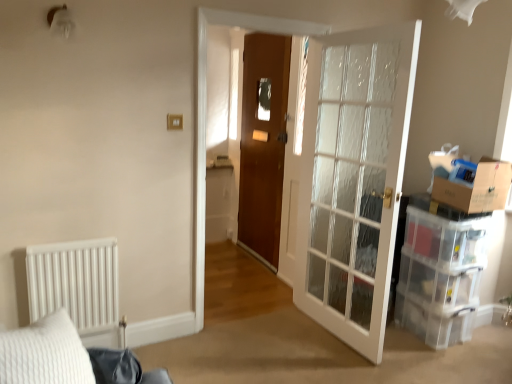
Image resolution: width=512 pixels, height=384 pixels. In order to click on wooden door at center in this screenshot , I will do `click(263, 143)`.

What do you see at coordinates (263, 143) in the screenshot? I see `wooden door at center` at bounding box center [263, 143].

Measure the distance between clear glass door at right and camera.

2.25 meters.

Locate an element on the screen. Image resolution: width=512 pixels, height=384 pixels. wooden door at center is located at coordinates (263, 143).

How much distance is there between clear plastic drawer at right and clear plastic storage box at right?

A distance of 5.93 inches exists between clear plastic drawer at right and clear plastic storage box at right.

Which of these two, clear plastic drawer at right or clear plastic storage box at right, is smaller?

clear plastic drawer at right.

Can you see clear plastic drawer at right touching clear plastic storage box at right?

No, clear plastic drawer at right is not in contact with clear plastic storage box at right.

Which is in front, point (421, 282) or point (448, 255)?

The point (448, 255) is closer.

Visually, is wooden door at center positioned to the left or to the right of clear glass door at right?

In the image, wooden door at center appears on the left side of clear glass door at right.

Is wooden door at center bigger than clear glass door at right?

Incorrect, wooden door at center is not larger than clear glass door at right.

Considering the relative sizes of wooden door at center and clear glass door at right in the image provided, is wooden door at center shorter than clear glass door at right?

No, wooden door at center is not shorter than clear glass door at right.

From the image's perspective, which one is positioned higher, wooden door at center or clear glass door at right?

wooden door at center, from the image's perspective.

From a real-world perspective, between clear glass door at right and brown cardboard box at right, who is vertically lower?

In real-world perspective, clear glass door at right is lower.

Considering the relative sizes of clear glass door at right and brown cardboard box at right in the image provided, is clear glass door at right wider than brown cardboard box at right?

No.

Based on the photo, can you confirm if clear glass door at right is positioned to the left of brown cardboard box at right?

Correct, you'll find clear glass door at right to the left of brown cardboard box at right.

Is brown cardboard box at right completely or partially inside clear glass door at right?

No.

Is clear glass door at right a part of clear plastic drawer at right?

No, clear plastic drawer at right does not contain clear glass door at right.

Is clear plastic drawer at right facing away from clear glass door at right?

That's not correct — clear plastic drawer at right is not looking away from clear glass door at right.

Consider the image. How different are the orientations of clear plastic drawer at right and clear glass door at right in degrees?

99 degrees separate the facing orientations of clear plastic drawer at right and clear glass door at right.

Are clear glass door at right and clear plastic drawer at right making contact?

clear glass door at right is not next to clear plastic drawer at right, and they're not touching.

From the picture: From the image's perspective, which is below, clear glass door at right or clear plastic drawer at right?

clear plastic drawer at right.

Is clear glass door at right oriented towards clear plastic drawer at right?

No, clear glass door at right is not oriented towards clear plastic drawer at right.

Considering the relative positions of white matte radiator at left and clear plastic drawer at right in the image provided, is white matte radiator at left to the left or to the right of clear plastic drawer at right?

white matte radiator at left is to the left of clear plastic drawer at right.

Which of these two, white matte radiator at left or clear plastic drawer at right, stands shorter?

Standing shorter between the two is clear plastic drawer at right.

Based on the photo, is there a large distance between white matte radiator at left and clear plastic drawer at right?

That's right, there is a large distance between white matte radiator at left and clear plastic drawer at right.

Would you say white matte radiator at left is outside clear plastic drawer at right?

Indeed, white matte radiator at left is completely outside clear plastic drawer at right.

Is clear glass door at right completely or partially outside of wooden door at center?

Absolutely, clear glass door at right is external to wooden door at center.

Based on the photo, how distant is clear glass door at right from wooden door at center?

33.89 inches.

Is clear glass door at right next to wooden door at center?

No, clear glass door at right is not beside wooden door at center.

In the image, is clear glass door at right positioned in front of or behind wooden door at center?

Visually, clear glass door at right is located in front of wooden door at center.

Where is `storage box in front of the clear plastic drawer at right`? The image size is (512, 384). storage box in front of the clear plastic drawer at right is located at coordinates (446, 240).

Locate an element on the screen. The width and height of the screenshot is (512, 384). door behind the clear glass door at right is located at coordinates (263, 143).

Which object lies further to the anchor point white matte radiator at left, clear glass door at right or brown cardboard box at right?

Based on the image, brown cardboard box at right appears to be further to white matte radiator at left.

From the image, which object appears to be nearer to brown cardboard box at right, clear plastic drawer at right or white matte radiator at left?

clear plastic drawer at right lies closer to brown cardboard box at right than the other object.

Looking at the image, which one is located closer to brown cardboard box at right, clear glass door at right or white matte radiator at left?

clear glass door at right lies closer to brown cardboard box at right than the other object.

When comparing their distances from clear plastic drawer at right, does clear plastic storage box at right or white matte radiator at left seem closer?

Among the two, clear plastic storage box at right is located nearer to clear plastic drawer at right.

Considering their positions, is brown cardboard box at right positioned closer to clear glass door at right than clear plastic drawer at right?

clear plastic drawer at right.

Considering their positions, is wooden door at center positioned further to clear plastic storage box at right than clear glass door at right?

Among the two, wooden door at center is located further to clear plastic storage box at right.

Estimate the real-world distances between objects in this image. Which object is closer to wooden door at center, clear glass door at right or white matte radiator at left?

clear glass door at right is closer to wooden door at center.

Estimate the real-world distances between objects in this image. Which object is closer to clear glass door at right, brown cardboard box at right or white matte radiator at left?

The object closer to clear glass door at right is brown cardboard box at right.

At what (x,y) coordinates should I click in order to perform the action: click on glass door located between white matte radiator at left and brown cardboard box at right in the left-right direction. Please return your answer as a coordinate pair (x, y). Looking at the image, I should click on (353, 184).

Identify the location of glass door between wooden door at center and brown cardboard box at right from left to right. The width and height of the screenshot is (512, 384). (353, 184).

Where is `drawer located between clear glass door at right and wooden door at center in the depth direction`? The image size is (512, 384). drawer located between clear glass door at right and wooden door at center in the depth direction is located at coordinates (438, 284).

This screenshot has height=384, width=512. Identify the location of drawer located between white matte radiator at left and clear plastic storage box at right in the left-right direction. (438, 284).